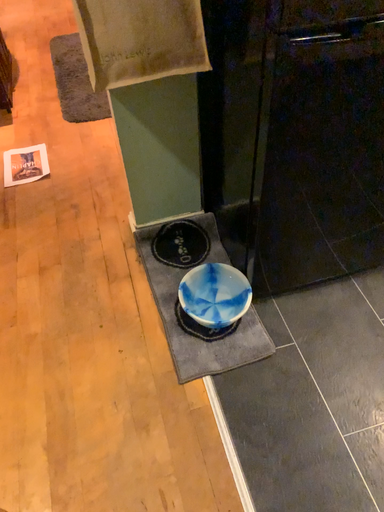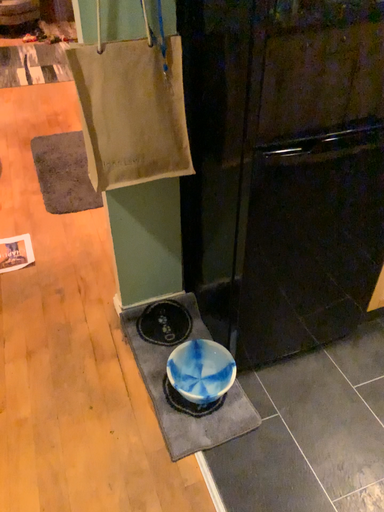
Question: How did the camera likely rotate when shooting the video?

Choices:
 (A) rotated upward
 (B) rotated downward

Answer: (A)